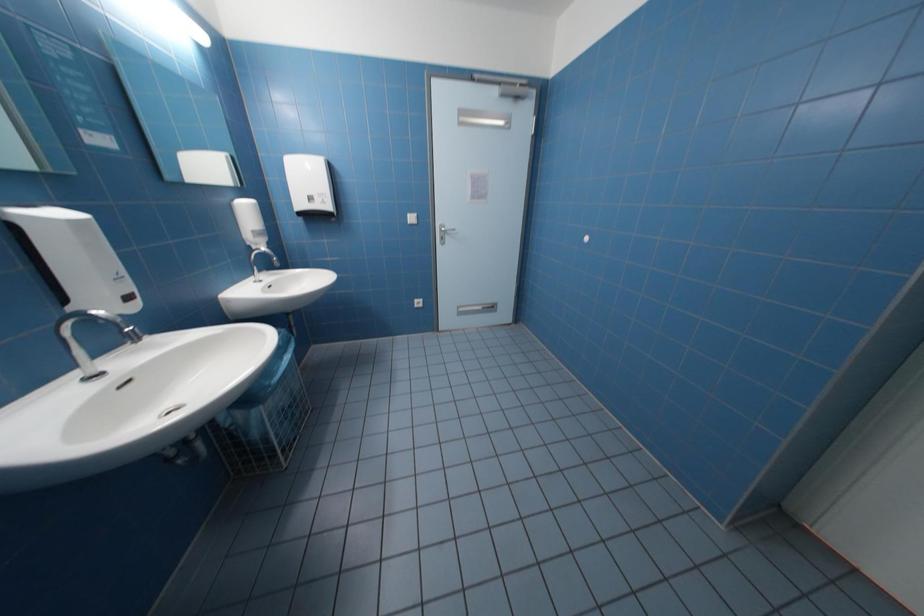
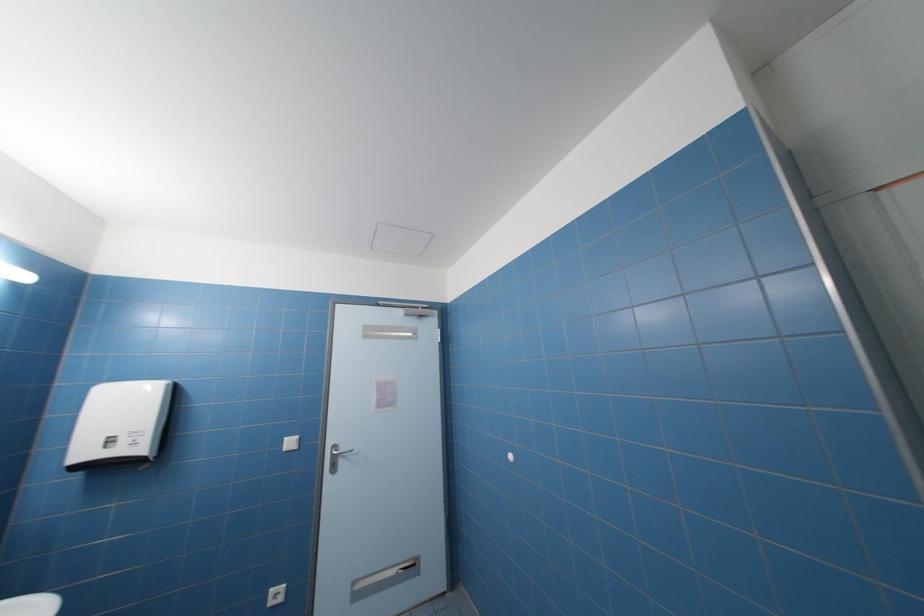
First-person continuous shooting, in which direction is the camera rotating?

The camera rotated toward right-up.